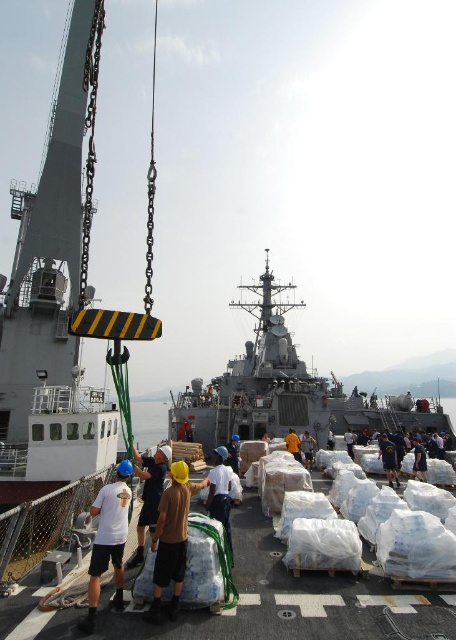
Which is above, gray metallic ship at center or white matte shirt at center?

gray metallic ship at center is higher up.

Is point (265, 262) closer to viewer compared to point (224, 499)?

No, (265, 262) is further to viewer.

Locate an element on the screen. Image resolution: width=456 pixels, height=640 pixels. gray metallic ship at center is located at coordinates (280, 388).

Identify the location of gray metallic ship at center. The image size is (456, 640). (280, 388).

Measure the distance between brown fabric shirt at center and camera.

They are 53.62 meters apart.

Between point (181, 554) and point (226, 492), which one is positioned in front?

Point (181, 554) is more forward.

This screenshot has height=640, width=456. In order to click on brown fabric shirt at center in this screenshot , I will do `click(171, 538)`.

Does gray metallic ship at center appear over brown fabric shirt at center?

Yes, gray metallic ship at center is above brown fabric shirt at center.

Who is positioned more to the left, gray metallic ship at center or brown fabric shirt at center?

brown fabric shirt at center is more to the left.

Who is more forward, (446, 422) or (156, 560)?

Result: Point (156, 560) is more forward.

I want to click on gray metallic ship at center, so click(x=280, y=388).